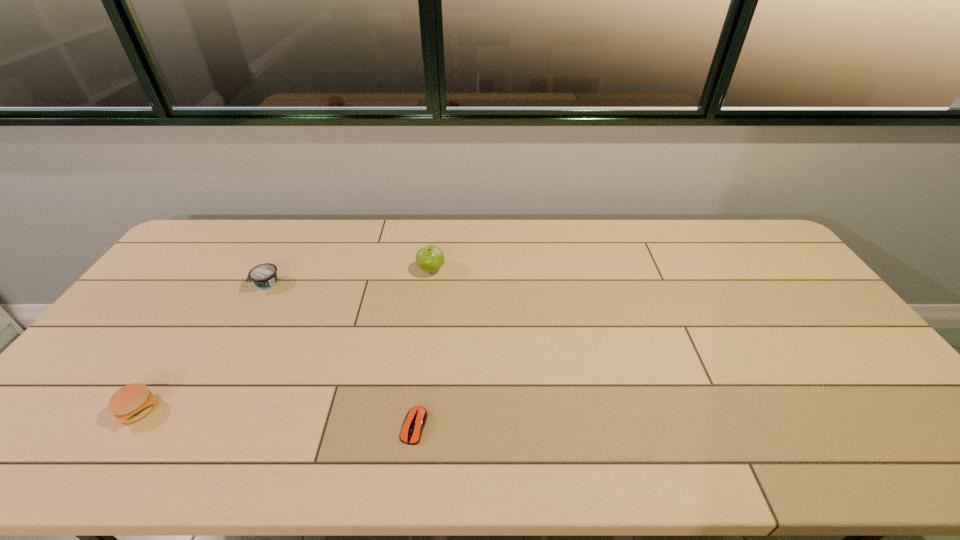
At what (x,y) coordinates should I click in order to perform the action: click on object located in the near edge section of the desktop. Please return your answer as a coordinate pair (x, y). Looking at the image, I should click on (416, 418).

The height and width of the screenshot is (540, 960). In order to click on object that is positioned at the left edge in this screenshot , I will do `click(130, 403)`.

The width and height of the screenshot is (960, 540). In the image, there is a desktop. In order to click on vacant space at the far edge in this screenshot , I will do `click(333, 256)`.

Image resolution: width=960 pixels, height=540 pixels. In the image, there is a desktop. What are the coordinates of `blank space at the near edge` in the screenshot? It's located at (223, 445).

I want to click on vacant space at the left edge, so click(x=108, y=362).

At what (x,y) coordinates should I click in order to perform the action: click on vacant area at the right edge of the desktop. Please return your answer as a coordinate pair (x, y). Looking at the image, I should click on (793, 293).

Find the location of a particular element. The image size is (960, 540). vacant space at the far left corner of the desktop is located at coordinates (201, 248).

I want to click on free point between the apple and the third tallest object, so click(349, 277).

Where is `free area in between the second tallest object and the apple`? free area in between the second tallest object and the apple is located at coordinates (285, 340).

Locate an element on the screen. blank region between the shortest object and the second object from left to right is located at coordinates (341, 355).